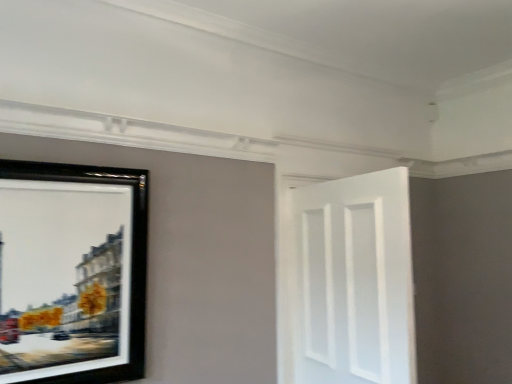
Question: Is white matte door at right taller or shorter than black matte picture frame at left?

Choices:
 (A) tall
 (B) short

Answer: (A)

Question: From a real-world perspective, relative to black matte picture frame at left, is white matte door at right vertically above or below?

Choices:
 (A) above
 (B) below

Answer: (B)

Question: Is white matte door at right in front of or behind black matte picture frame at left in the image?

Choices:
 (A) behind
 (B) front

Answer: (A)

Question: In terms of height, does black matte picture frame at left look taller or shorter compared to white matte door at right?

Choices:
 (A) tall
 (B) short

Answer: (B)

Question: Is black matte picture frame at left to the left or to the right of white matte door at right in the image?

Choices:
 (A) right
 (B) left

Answer: (B)

Question: In the image, is black matte picture frame at left positioned in front of or behind white matte door at right?

Choices:
 (A) behind
 (B) front

Answer: (B)

Question: From the image's perspective, is black matte picture frame at left above or below white matte door at right?

Choices:
 (A) above
 (B) below

Answer: (A)